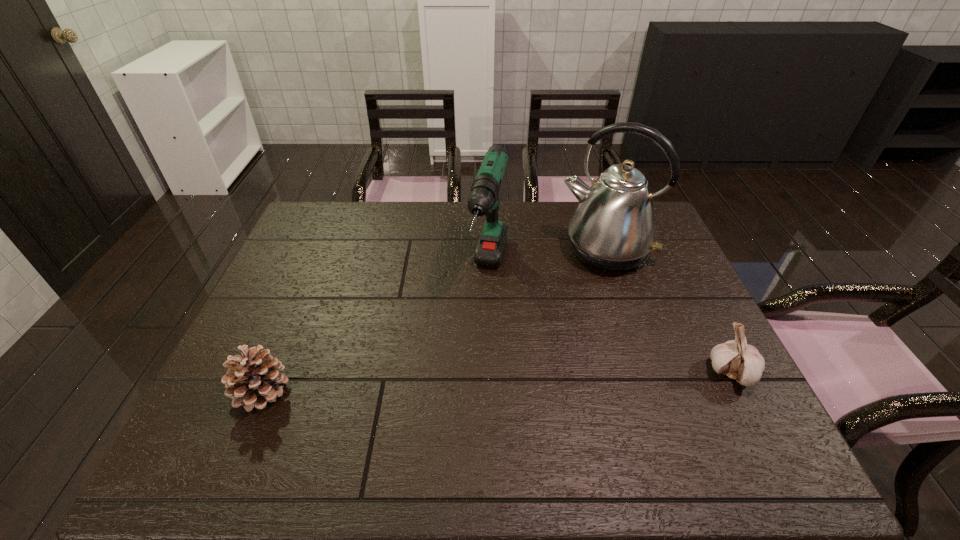
The width and height of the screenshot is (960, 540). Identify the location of empty location between the pinecone and the garlic. (496, 382).

Where is `free space between the garlic and the pinecone`? This screenshot has height=540, width=960. free space between the garlic and the pinecone is located at coordinates (496, 382).

Locate an element on the screen. free space that is in between the tallest object and the garlic is located at coordinates (668, 312).

This screenshot has height=540, width=960. What are the coordinates of `vacant space that's between the second tallest object and the garlic` in the screenshot? It's located at (611, 323).

The height and width of the screenshot is (540, 960). In order to click on free area in between the leftmost object and the garlic in this screenshot , I will do `click(496, 382)`.

What are the coordinates of `object that stands as the closest to the garlic` in the screenshot? It's located at (613, 229).

In order to click on object that is the third nearest to the kettle in this screenshot , I will do `click(253, 380)`.

Image resolution: width=960 pixels, height=540 pixels. Identify the location of free space that satisfies the following two spatial constraints: 1. on the back side of the tallest object; 2. on the right side of the pinecone. (322, 251).

This screenshot has height=540, width=960. I want to click on blank space that satisfies the following two spatial constraints: 1. on the front side of the garlic; 2. on the right side of the kettle, so click(x=647, y=373).